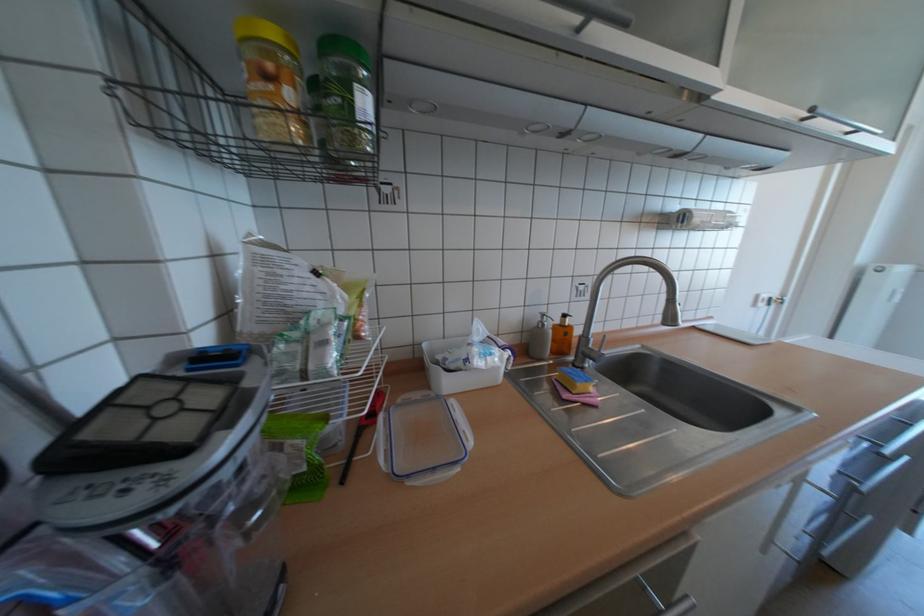
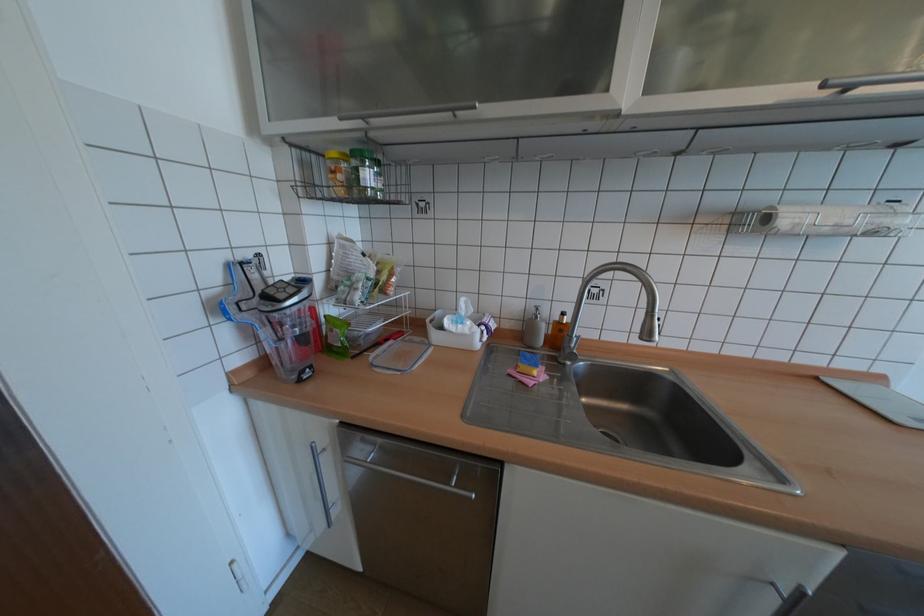
The point at (373, 111) is marked in the first image. Where is the corresponding point in the second image?

(373, 179)